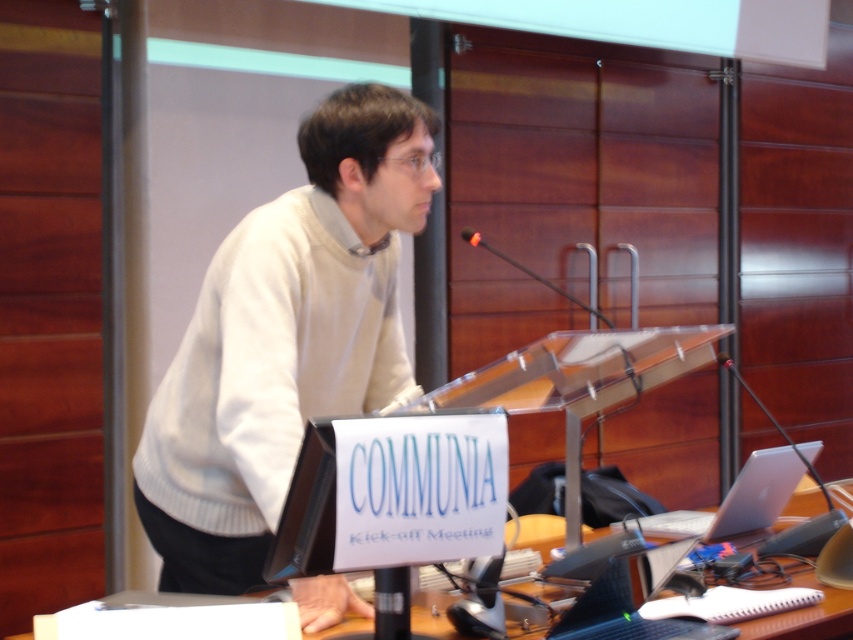
Does point (345, 128) come closer to viewer compared to point (822, 504)?

Yes, point (345, 128) is closer to viewer.

Does point (358, 144) come behind point (816, 497)?

No, it is not.

Find the location of a particular element. white knitted sweater at center is located at coordinates (285, 339).

Between point (241, 284) and point (762, 506), which one is positioned in front?

Point (241, 284)

Does point (257, 307) come behind point (735, 490)?

No, (257, 307) is closer to viewer.

Is point (276, 296) positioned before point (773, 476)?

Yes.

The height and width of the screenshot is (640, 853). I want to click on white knitted sweater at center, so click(285, 339).

Between silver metallic laptop at lower right and wooden table at center, which one is positioned lower?

wooden table at center is lower down.

Which is behind, point (733, 490) or point (747, 632)?

Positioned behind is point (733, 490).

Find the location of `silver metallic laptop at lower right`. silver metallic laptop at lower right is located at coordinates (737, 500).